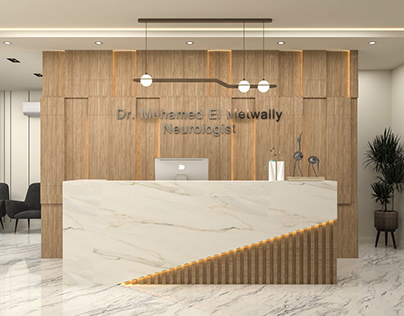
Identify the location of light. Image resolution: width=404 pixels, height=316 pixels. (262, 85).